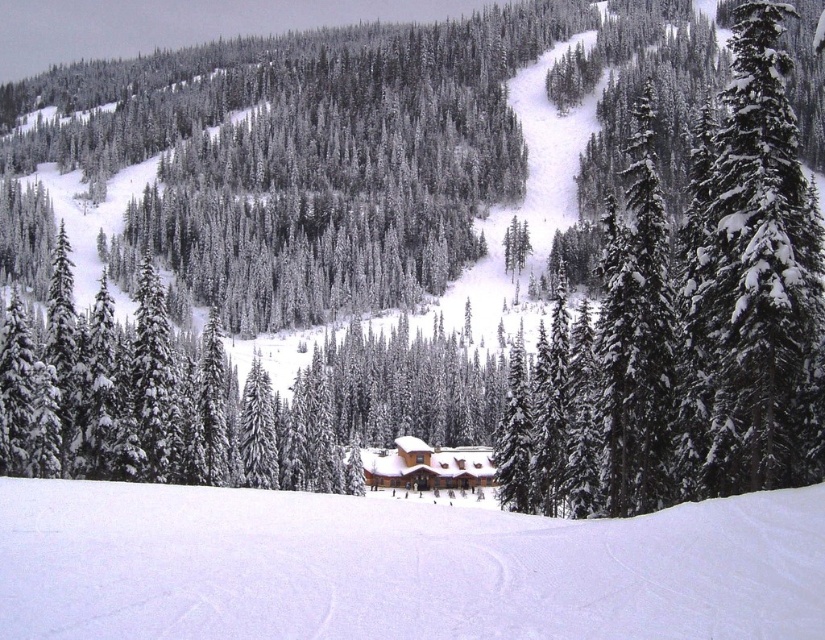
Does snow-covered evergreen at right have a lesser height compared to brown wooden cabin at center?

In fact, snow-covered evergreen at right may be taller than brown wooden cabin at center.

Based on the photo, which of these two, snow-covered evergreen at right or brown wooden cabin at center, stands shorter?

With less height is brown wooden cabin at center.

Between point (779, 230) and point (418, 460), which one is positioned in front?

Positioned in front is point (779, 230).

I want to click on snow-covered evergreen at right, so click(x=759, y=268).

Does green textured pine tree at upper center have a larger size compared to brown wooden cabin at center?

Indeed, green textured pine tree at upper center has a larger size compared to brown wooden cabin at center.

Does green textured pine tree at upper center have a smaller size compared to brown wooden cabin at center?

No, green textured pine tree at upper center is not smaller than brown wooden cabin at center.

Between point (742, 29) and point (404, 452), which one is positioned in front?

Point (742, 29) is in front.

The height and width of the screenshot is (640, 825). I want to click on green textured pine tree at upper center, so click(714, 300).

What do you see at coordinates (398, 566) in the screenshot? I see `white snow ski slope at center` at bounding box center [398, 566].

Locate an element on the screen. white snow ski slope at center is located at coordinates (398, 566).

Identify the location of white snow ski slope at center. (398, 566).